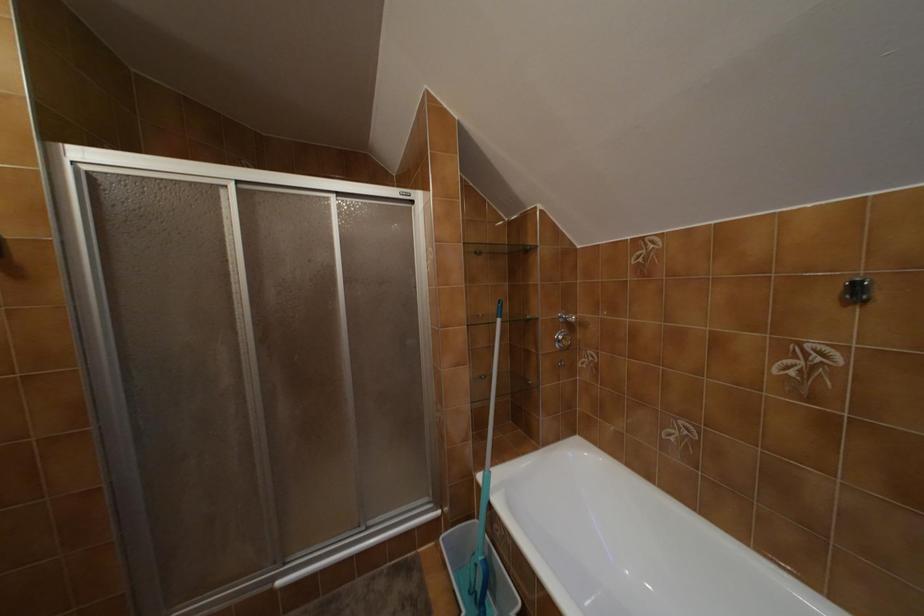
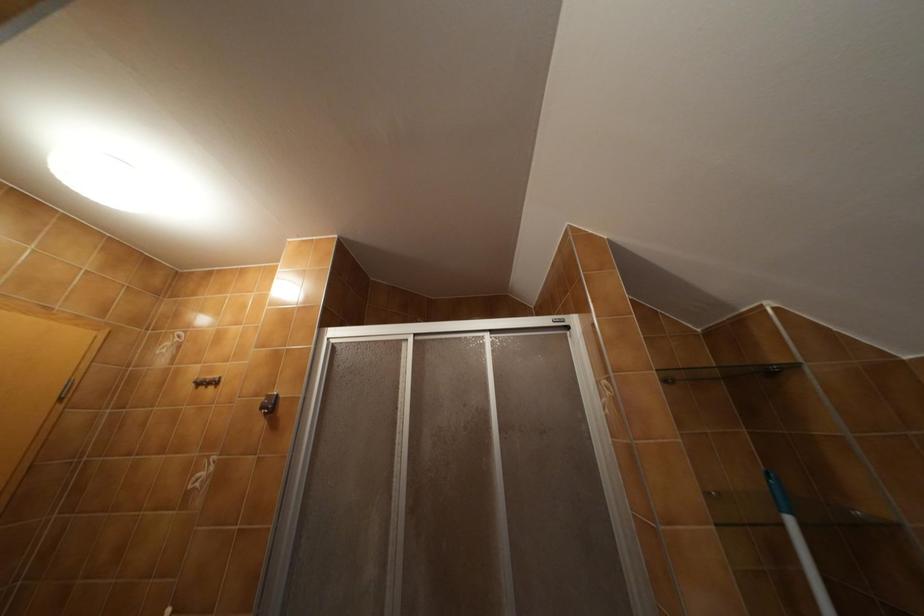
The images are taken continuously from a first-person perspective. In which direction is your viewpoint rotating?

The camera rotated toward left-up.